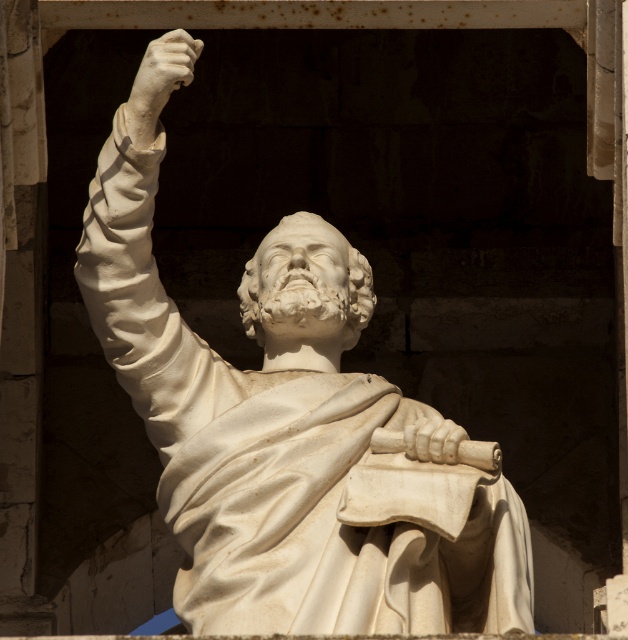
Between white marble statue at center and white marble hand at upper left, which one is positioned lower?

white marble statue at center is lower down.

Is point (423, 556) behind point (154, 44)?

No, it is not.

What are the coordinates of `white marble statue at center` in the screenshot? It's located at (288, 436).